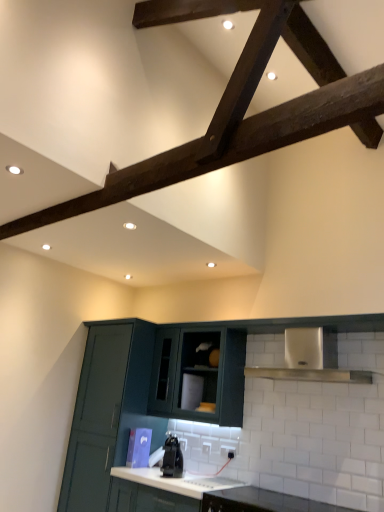
Question: Would you say black glossy kettle at center contains matte dark green cabinet at center, which is the second cabinetry in right-to-left order?

Choices:
 (A) yes
 (B) no

Answer: (B)

Question: From a real-world perspective, is black glossy kettle at center over matte dark green cabinet at center, which is the second cabinetry in right-to-left order?

Choices:
 (A) yes
 (B) no

Answer: (B)

Question: Considering the relative sizes of black glossy kettle at center and matte dark green cabinet at center, which is the second cabinetry in right-to-left order, in the image provided, is black glossy kettle at center taller than matte dark green cabinet at center, which is the second cabinetry in right-to-left order,?

Choices:
 (A) yes
 (B) no

Answer: (B)

Question: Does black glossy kettle at center lie behind matte dark green cabinet at center, which is the second cabinetry in right-to-left order?

Choices:
 (A) yes
 (B) no

Answer: (B)

Question: Is black glossy kettle at center positioned before matte dark green cabinet at center, which is the second cabinetry in right-to-left order?

Choices:
 (A) yes
 (B) no

Answer: (A)

Question: In terms of size, does matte dark green cabinet at center, the 3th cabinetry from the left, appear bigger or smaller than black glossy kettle at center?

Choices:
 (A) big
 (B) small

Answer: (A)

Question: From the image's perspective, is matte dark green cabinet at center, the 1th cabinetry in the right-to-left sequence, above or below black glossy kettle at center?

Choices:
 (A) above
 (B) below

Answer: (A)

Question: Is point (301, 462) closer or farther from the camera than point (162, 458)?

Choices:
 (A) farther
 (B) closer

Answer: (B)

Question: From a real-world perspective, is matte dark green cabinet at center, the 1th cabinetry in the right-to-left sequence, above or below black glossy kettle at center?

Choices:
 (A) above
 (B) below

Answer: (A)

Question: From a real-world perspective, is black glossy kettle at center positioned above or below matte dark green cabinet at center, the 1th cabinetry in the right-to-left sequence?

Choices:
 (A) below
 (B) above

Answer: (A)

Question: Based on their sizes in the image, would you say black glossy kettle at center is bigger or smaller than matte dark green cabinet at center, the 3th cabinetry from the left?

Choices:
 (A) big
 (B) small

Answer: (B)

Question: Relative to matte dark green cabinet at center, the 1th cabinetry in the right-to-left sequence, is black glossy kettle at center in front or behind?

Choices:
 (A) behind
 (B) front

Answer: (A)

Question: Considering the positions of point (177, 466) and point (167, 368), is point (177, 466) closer or farther from the camera than point (167, 368)?

Choices:
 (A) closer
 (B) farther

Answer: (A)

Question: Relative to matte dark green cabinet at center, which is the second cabinetry in right-to-left order, is white glossy countertop at lower center, arranged as the 1th countertop when viewed from the right, in front or behind?

Choices:
 (A) behind
 (B) front

Answer: (B)

Question: In terms of size, does white glossy countertop at lower center, arranged as the 1th countertop when viewed from the right, appear bigger or smaller than matte dark green cabinet at center, the 2th cabinetry viewed from the left?

Choices:
 (A) small
 (B) big

Answer: (A)